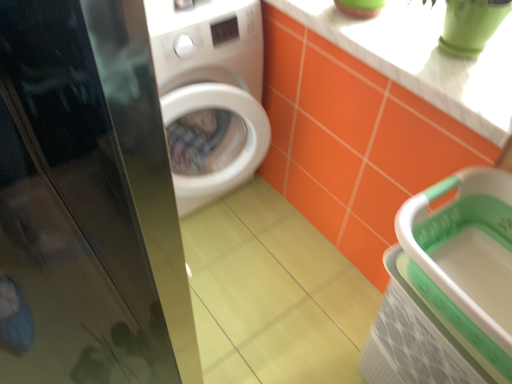
Question: Does glossy black screen door at left have a lesser height compared to green plastic basket at lower right?

Choices:
 (A) yes
 (B) no

Answer: (B)

Question: From the image's perspective, is glossy black screen door at left located beneath green plastic basket at lower right?

Choices:
 (A) yes
 (B) no

Answer: (B)

Question: Are glossy black screen door at left and green plastic basket at lower right making contact?

Choices:
 (A) yes
 (B) no

Answer: (B)

Question: Can you confirm if glossy black screen door at left is positioned to the left of green plastic basket at lower right?

Choices:
 (A) no
 (B) yes

Answer: (B)

Question: From a real-world perspective, is glossy black screen door at left located higher than green plastic basket at lower right?

Choices:
 (A) yes
 (B) no

Answer: (A)

Question: Visually, is glossy black screen door at left positioned to the left or to the right of white glossy counter top at upper right?

Choices:
 (A) left
 (B) right

Answer: (A)

Question: Is glossy black screen door at left wider or thinner than white glossy counter top at upper right?

Choices:
 (A) thin
 (B) wide

Answer: (A)

Question: In the image, is glossy black screen door at left positioned in front of or behind white glossy counter top at upper right?

Choices:
 (A) front
 (B) behind

Answer: (A)

Question: Based on their sizes in the image, would you say glossy black screen door at left is bigger or smaller than white glossy counter top at upper right?

Choices:
 (A) big
 (B) small

Answer: (B)

Question: Considering the relative positions of white glossy counter top at upper right and green plastic basket at lower right in the image provided, is white glossy counter top at upper right to the left or to the right of green plastic basket at lower right?

Choices:
 (A) right
 (B) left

Answer: (B)

Question: Is white glossy counter top at upper right in front of or behind green plastic basket at lower right in the image?

Choices:
 (A) front
 (B) behind

Answer: (B)

Question: Does point (433, 84) appear closer or farther from the camera than point (493, 180)?

Choices:
 (A) farther
 (B) closer

Answer: (B)

Question: Is white glossy counter top at upper right bigger or smaller than green plastic basket at lower right?

Choices:
 (A) big
 (B) small

Answer: (B)

Question: Would you say white glossy counter top at upper right is to the left or to the right of glossy black screen door at left in the picture?

Choices:
 (A) left
 (B) right

Answer: (B)

Question: Does point (384, 71) appear closer or farther from the camera than point (125, 258)?

Choices:
 (A) closer
 (B) farther

Answer: (A)